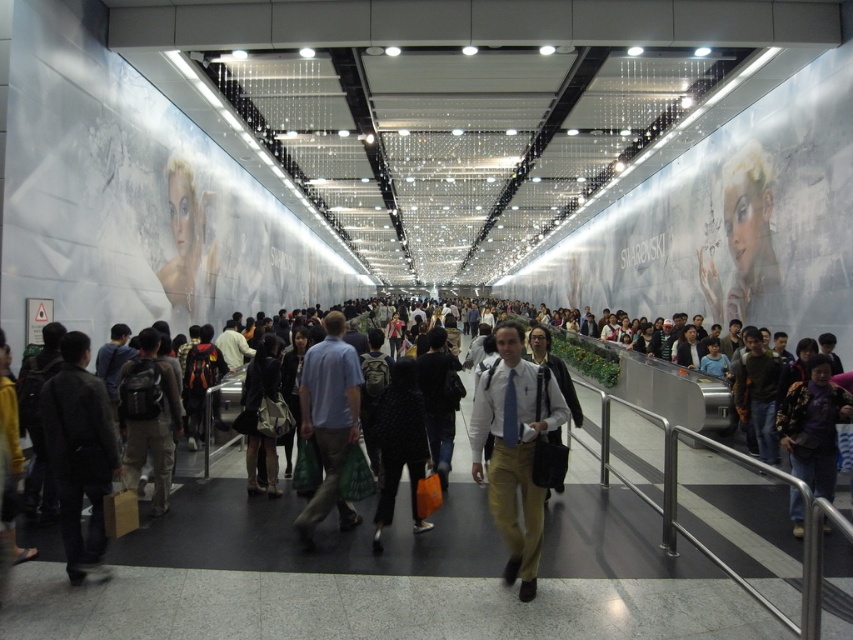
You are a commuter standing in the corridor and you want to check if your light brown cotton pants at center are visible from above. Since the dark gray jacket at center is blocking your view, can you see them?

The light brown cotton pants at center is located below dark gray jacket at center, so they are blocked from view from above.

Consider the image. You are standing in the corridor and want to reach a specific location marked by point (532,456) and point (318,352). Which point is closer to your current position?

Point (532,456) is closer to the viewer than point (318,352), so you are closer to point (532,456).

You are a commuter standing in the middle of the corridor and notice two people wearing the dark purple fabric jacket at center and the black dotted sweater at center. Which clothing item is closer to the ground?

The dark purple fabric jacket at center is closer to the ground because it is below the black dotted sweater at center.